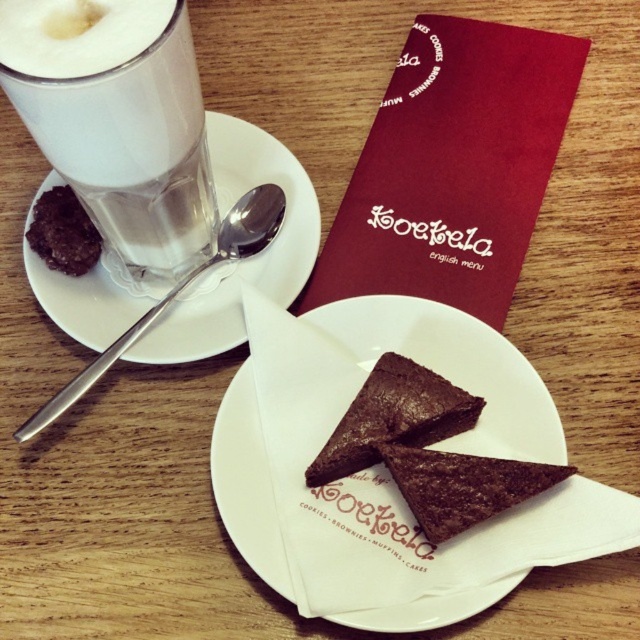
Question: Which object is the farthest from the chocolate matte at left?

Choices:
 (A) chocolate cake at center
 (B) chocolate matte at center

Answer: (A)

Question: Can you confirm if white ceramic saucer at upper left is smaller than chocolate matte at center?

Choices:
 (A) yes
 (B) no

Answer: (B)

Question: Which of the following is the farthest from the observer?

Choices:
 (A) tap(563, 474)
 (B) tap(138, 225)

Answer: (B)

Question: Is white paper plate at center to the left of chocolate cake at center from the viewer's perspective?

Choices:
 (A) no
 (B) yes

Answer: (B)

Question: Is chocolate matte at center closer to camera compared to chocolate matte at left?

Choices:
 (A) yes
 (B) no

Answer: (A)

Question: Which point is farther to the camera?

Choices:
 (A) chocolate cake at center
 (B) white paper plate at center

Answer: (A)